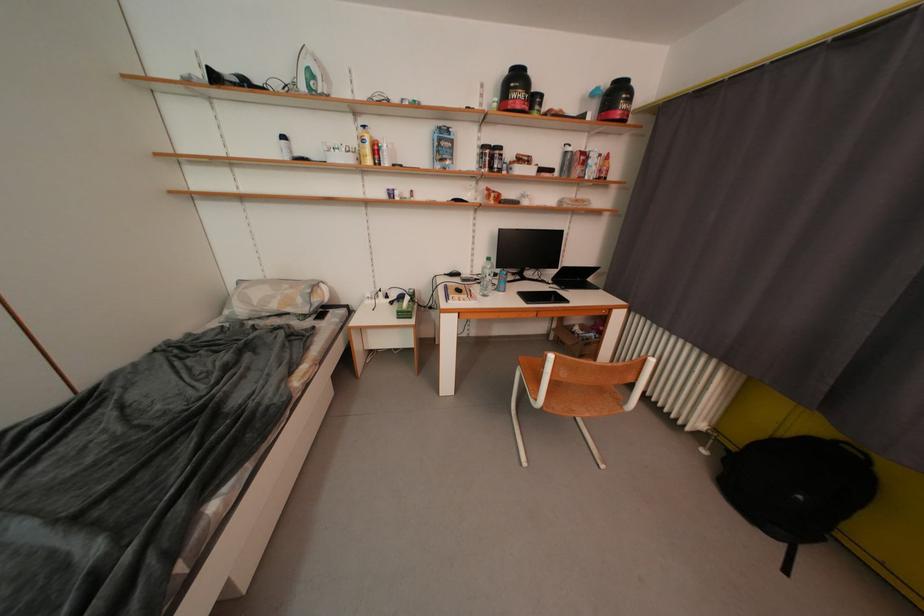
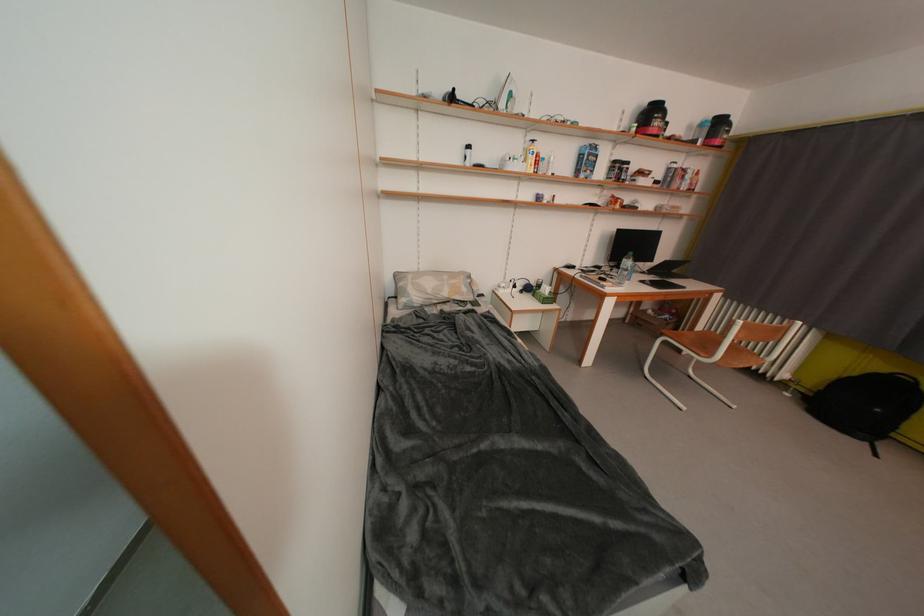
Locate, in the second image, the point that corresponds to pixel 798 437 in the first image.

(862, 377)